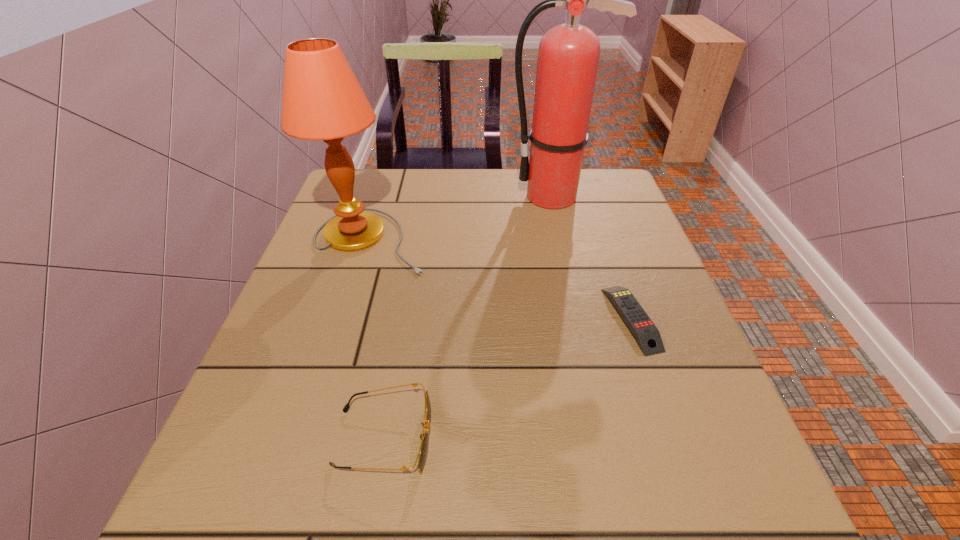
You are a GUI agent. You are given a task and a screenshot of the screen. Output one action in this format:
    pyautogui.click(x=<x>, y=<y>)
    Task: Click on the vacant space that is in between the remote control and the lamp
    
    Given the screenshot: What is the action you would take?
    pyautogui.click(x=501, y=280)

Locate an element on the screen. The height and width of the screenshot is (540, 960). vacant area that lies between the shortest object and the second tallest object is located at coordinates [501, 280].

Locate an element on the screen. The image size is (960, 540). free point between the lamp and the sunglasses is located at coordinates (377, 339).

Find the location of `vacant area between the third shortest object and the second shortest object`. vacant area between the third shortest object and the second shortest object is located at coordinates (377, 339).

The image size is (960, 540). What are the coordinates of `free area in between the nearest object and the fire extinguisher` in the screenshot? It's located at (468, 317).

This screenshot has width=960, height=540. In order to click on free space between the third shortest object and the tallest object in this screenshot , I will do `click(462, 219)`.

Image resolution: width=960 pixels, height=540 pixels. In order to click on object that ranks as the third closest to the sunglasses in this screenshot , I will do coord(568,55).

Locate which object ranks third in proximity to the tallest object. Please provide its 2D coordinates. Your answer should be formatted as a tuple, i.e. [(x, y)], where the tuple contains the x and y coordinates of a point satisfying the conditions above.

[(422, 453)]

Locate an element on the screen. Image resolution: width=960 pixels, height=540 pixels. vacant space that satisfies the following two spatial constraints: 1. on the front side of the lamp; 2. on the left side of the third farthest object is located at coordinates (348, 319).

You are a GUI agent. You are given a task and a screenshot of the screen. Output one action in this format:
    pyautogui.click(x=<x>, y=<y>)
    Task: Click on the blank area in the image that satisfies the following two spatial constraints: 1. on the hose direction of the tallest object; 2. on the back side of the remote control
    This screenshot has height=540, width=960.
    Given the screenshot: What is the action you would take?
    pyautogui.click(x=582, y=319)